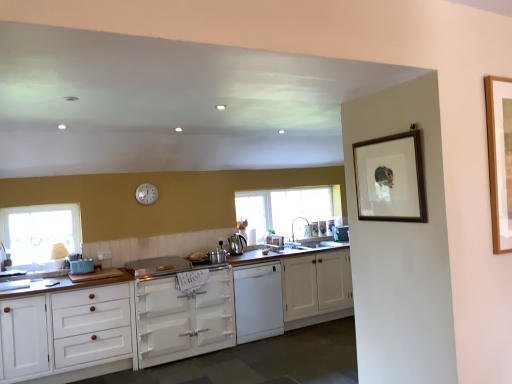
Describe the element at coordinates (288, 212) in the screenshot. I see `clear glass window at center, arranged as the first window when viewed from the back` at that location.

The width and height of the screenshot is (512, 384). I want to click on teal matte toaster at lower left, the first appliance from the front, so click(x=81, y=266).

What do you see at coordinates (146, 194) in the screenshot?
I see `white metallic clock at upper center` at bounding box center [146, 194].

Locate an element on the screen. wooden picture frame at right, which is counted as the 2th picture frame, starting from the back is located at coordinates (499, 159).

Where is `cabinetry that is the 1st one when counting downward from the white glossy dishwasher at center, marked as the 4th appliance in a right-to-left arrangement (from the image's perspective)`? This screenshot has height=384, width=512. cabinetry that is the 1st one when counting downward from the white glossy dishwasher at center, marked as the 4th appliance in a right-to-left arrangement (from the image's perspective) is located at coordinates (316, 284).

Between point (269, 239) and point (293, 309), which one is positioned in front?

Positioned in front is point (293, 309).

Is white glossy dishwasher at center, the fourth appliance in the back-to-front sequence, in front of or behind white wood cabinet at center, placed as the third cabinetry when sorted from left to right, in the image?

white glossy dishwasher at center, the fourth appliance in the back-to-front sequence, is behind white wood cabinet at center, placed as the third cabinetry when sorted from left to right.

Between white glossy dishwasher at center, the 3th appliance in the front-to-back sequence, and white wood cabinet at center, the 1th cabinetry positioned from the right, which one appears on the left side from the viewer's perspective?

From the viewer's perspective, white glossy dishwasher at center, the 3th appliance in the front-to-back sequence, appears more on the left side.

How much distance is there between white matte oven at center, the second cabinetry in the right-to-left sequence, and white glossy sink at center, which is counted as the 5th appliance, starting from the front?

A distance of 1.92 meters exists between white matte oven at center, the second cabinetry in the right-to-left sequence, and white glossy sink at center, which is counted as the 5th appliance, starting from the front.

Is white matte oven at center, the second cabinetry in the right-to-left sequence, positioned behind white glossy sink at center, which appears as the 2th appliance when viewed from the back?

No, white matte oven at center, the second cabinetry in the right-to-left sequence, is in front of white glossy sink at center, which appears as the 2th appliance when viewed from the back.

Is white matte oven at center, acting as the second cabinetry starting from the left, oriented towards white glossy sink at center, arranged as the third appliance when viewed from the right?

No, white matte oven at center, acting as the second cabinetry starting from the left, is not aimed at white glossy sink at center, arranged as the third appliance when viewed from the right.

Considering the sizes of objects white matte oven at center, acting as the second cabinetry starting from the left, and white glossy sink at center, which appears as the 2th appliance when viewed from the back, in the image provided, who is wider, white matte oven at center, acting as the second cabinetry starting from the left, or white glossy sink at center, which appears as the 2th appliance when viewed from the back,?

Wider between the two is white matte oven at center, acting as the second cabinetry starting from the left.

At what (x,y) coordinates should I click in order to perform the action: click on the 2nd picture frame in front of the white glossy dishwasher at center, the 3th appliance viewed from the left. Please return your answer as a coordinate pair (x, y). The image size is (512, 384). Looking at the image, I should click on (499, 159).

Between white glossy dishwasher at center, the 3th appliance viewed from the left, and wooden picture frame at right, which appears as the 1th picture frame when viewed from the right, which one has larger width?

white glossy dishwasher at center, the 3th appliance viewed from the left, is wider.

From a real-world perspective, which object stands above the other?

In real-world perspective, wooden picture frame at right, which is the first picture frame in front-to-back order, is above.

Consider the image. Is white glossy dishwasher at center, marked as the 4th appliance in a right-to-left arrangement, taller than wooden picture frame at right, which is counted as the 2th picture frame, starting from the back?

Incorrect, the height of white glossy dishwasher at center, marked as the 4th appliance in a right-to-left arrangement, is not larger of that of wooden picture frame at right, which is counted as the 2th picture frame, starting from the back.

Is the position of white wood cabinet at lower left, positioned as the third cabinetry in right-to-left order, less distant than that of wooden framed print at upper right, the 2th picture frame positioned from the front?

That is False.

Can you tell me how much white wood cabinet at lower left, positioned as the third cabinetry in right-to-left order, and wooden framed print at upper right, placed as the 1th picture frame when sorted from back to front, differ in facing direction?

90.3 degrees.

Is white wood cabinet at lower left, which is counted as the first cabinetry, starting from the left, turned away from wooden framed print at upper right, placed as the 1th picture frame when sorted from back to front?

No, wooden framed print at upper right, placed as the 1th picture frame when sorted from back to front, is not at the back of white wood cabinet at lower left, which is counted as the first cabinetry, starting from the left.

Who is shorter, teal matte toaster at lower left, the first appliance from the left, or clear glass window at left, marked as the second window in a right-to-left arrangement?

Standing shorter between the two is teal matte toaster at lower left, the first appliance from the left.

Is teal matte toaster at lower left, which is the sixth appliance from back to front, aimed at clear glass window at left, which ranks as the first window in left-to-right order?

No, teal matte toaster at lower left, which is the sixth appliance from back to front, is not oriented towards clear glass window at left, which ranks as the first window in left-to-right order.

From the image's perspective, which one is positioned higher, teal matte toaster at lower left, the first appliance from the front, or clear glass window at left, marked as the second window in a right-to-left arrangement?

clear glass window at left, marked as the second window in a right-to-left arrangement, from the image's perspective.

From a real-world perspective, is teal matte toaster at lower left, the 6th appliance viewed from the right, physically above clear glass window at left, which appears as the second window when viewed from the back?

No.

Considering the sizes of objects silver metallic gas stove at center and white wood cabinet at center, placed as the third cabinetry when sorted from left to right, in the image provided, who is smaller, silver metallic gas stove at center or white wood cabinet at center, placed as the third cabinetry when sorted from left to right,?

silver metallic gas stove at center.

Is silver metallic gas stove at center not near white wood cabinet at center, the 1th cabinetry positioned from the right?

Indeed, silver metallic gas stove at center is not near white wood cabinet at center, the 1th cabinetry positioned from the right.

Between silver metallic gas stove at center and white wood cabinet at center, the 1th cabinetry positioned from the right, which one appears on the right side from the viewer's perspective?

From the viewer's perspective, white wood cabinet at center, the 1th cabinetry positioned from the right, appears more on the right side.

How distant is silver metallic gas stove at center from white wood cabinet at center, the 1th cabinetry positioned from the right?

A distance of 1.29 meters exists between silver metallic gas stove at center and white wood cabinet at center, the 1th cabinetry positioned from the right.

Does point (212, 251) come in front of point (509, 166)?

That is False.

From the image's perspective, does silver metallic pot at center, the 2th appliance viewed from the left, appear higher than wooden picture frame at right, which is counted as the 2th picture frame, starting from the left?

No, from the image's perspective, silver metallic pot at center, the 2th appliance viewed from the left, is not above wooden picture frame at right, which is counted as the 2th picture frame, starting from the left.

Is silver metallic pot at center, positioned as the 5th appliance in right-to-left order, positioned with its back to wooden picture frame at right, which is counted as the 2th picture frame, starting from the left?

silver metallic pot at center, positioned as the 5th appliance in right-to-left order, is not turned away from wooden picture frame at right, which is counted as the 2th picture frame, starting from the left.

The width and height of the screenshot is (512, 384). In order to click on cabinetry that is the 1st object located below the white glossy dishwasher at center, the fourth appliance in the back-to-front sequence (from the image's perspective) in this screenshot , I will do `click(316, 284)`.

From the image's perspective, starting from the white matte oven at center, the second cabinetry in the right-to-left sequence, which appliance is the 5th one above? Please provide its 2D coordinates.

[(308, 231)]

When comparing their distances from white glossy sink at center, the first appliance when ordered from right to left, does white wood cabinet at center, the 1th cabinetry positioned from the right, or satin nickel faucet at center seem closer?

satin nickel faucet at center lies closer to white glossy sink at center, the first appliance when ordered from right to left, than the other object.

Which object lies further to the anchor point clear glass window at center, which is the second window in front-to-back order, white matte dishwasher at center or white wood cabinet at center, placed as the third cabinetry when sorted from left to right?

white matte dishwasher at center is positioned further to the anchor clear glass window at center, which is the second window in front-to-back order.

Which object lies nearer to the anchor point white matte dishwasher at center, white metallic clock at upper center or white wood cabinet at lower left, positioned as the third cabinetry in right-to-left order?

The object closer to white matte dishwasher at center is white wood cabinet at lower left, positioned as the third cabinetry in right-to-left order.

Based on their spatial positions, is satin nickel faucet at center or teal matte toaster at lower left, the 6th appliance viewed from the right, further from wooden picture frame at right, which is the first picture frame in front-to-back order?

satin nickel faucet at center.

When comparing their distances from clear glass window at left, which appears as the second window when viewed from the back, does teal matte toaster at lower left, the 6th appliance viewed from the right, or white matte oven at center, the second cabinetry in the right-to-left sequence, seem further?

white matte oven at center, the second cabinetry in the right-to-left sequence, is positioned further to the anchor clear glass window at left, which appears as the second window when viewed from the back.

Based on their spatial positions, is clear glass window at center, which is the second window in front-to-back order, or white metallic clock at upper center further from wooden picture frame at right, which is the first picture frame in front-to-back order?

clear glass window at center, which is the second window in front-to-back order, is positioned further to the anchor wooden picture frame at right, which is the first picture frame in front-to-back order.

Based on their spatial positions, is white glossy sink at center, the sixth appliance from the front, or polished stainless steel kettle at center closer to white matte oven at center, acting as the second cabinetry starting from the left?

polished stainless steel kettle at center is positioned closer to the anchor white matte oven at center, acting as the second cabinetry starting from the left.

From the image, which object appears to be farther from white metallic clock at upper center, white glossy dishwasher at center, the 3th appliance viewed from the left, or white matte dishwasher at center?

Among the two, white matte dishwasher at center is located further to white metallic clock at upper center.

At what (x,y) coordinates should I click in order to perform the action: click on faucet located between white wood cabinet at center, placed as the third cabinetry when sorted from left to right, and white glossy sink at center, the first appliance in the back-to-front sequence, in the depth direction. Please return your answer as a coordinate pair (x, y). Looking at the image, I should click on click(x=293, y=225).

Identify the location of gas stove between wooden framed print at upper right, placed as the 1th picture frame when sorted from back to front, and white matte dishwasher at center in the front-back direction. (165, 266).

Identify the location of faucet situated between teal matte toaster at lower left, the 6th appliance viewed from the right, and white glossy sink at center, which appears as the 2th appliance when viewed from the back, from left to right. (293, 225).

Find the location of a particular element. The image size is (512, 384). kitchen appliance between white wood cabinet at lower left, which is counted as the first cabinetry, starting from the left, and clear glass window at center, the 1th window from the right is located at coordinates (236, 244).